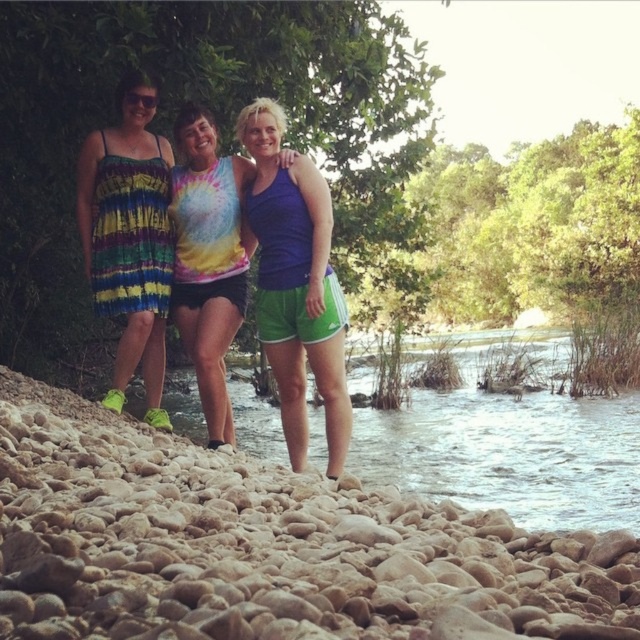
Consider the image. Is matte blue tank top at center to the left of rainbow striped dress at left from the viewer's perspective?

In fact, matte blue tank top at center is to the right of rainbow striped dress at left.

Is point (278, 342) positioned in front of point (92, 285)?

That is True.

Between point (260, 323) and point (131, 118), which one is positioned in front?

Point (260, 323) is in front.

The height and width of the screenshot is (640, 640). I want to click on matte blue tank top at center, so click(x=296, y=284).

Who is higher up, brown pebbles at lower left or rainbow tie-dye tank top at center?

rainbow tie-dye tank top at center is higher up.

Between point (56, 628) and point (198, 262), which one is positioned behind?

Point (198, 262)

Does point (92, 564) lie in front of point (236, 262)?

Yes, it is.

Find the location of `brown pebbles at lower left`. brown pebbles at lower left is located at coordinates (266, 547).

Who is more forward, (97, 305) or (177, 170)?

Point (97, 305) is more forward.

This screenshot has width=640, height=640. Describe the element at coordinates (129, 237) in the screenshot. I see `rainbow striped dress at left` at that location.

I want to click on rainbow striped dress at left, so click(x=129, y=237).